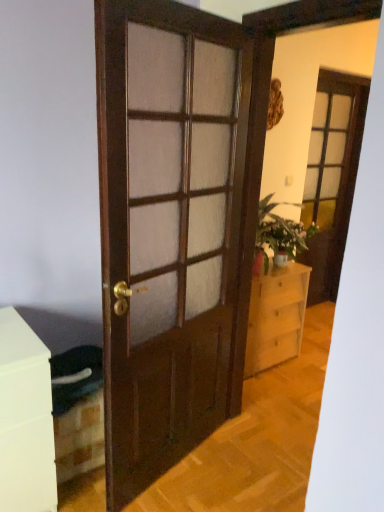
Question: In terms of width, does matte glass screen door at upper right look wider or thinner when compared to matte pink vase at center-right?

Choices:
 (A) wide
 (B) thin

Answer: (B)

Question: In terms of height, does matte glass screen door at upper right look taller or shorter compared to matte pink vase at center-right?

Choices:
 (A) short
 (B) tall

Answer: (B)

Question: Which of these objects is positioned closest to the matte pink vase at center-right?

Choices:
 (A) matte glass screen door at upper right
 (B) light wood chest of drawers at center
 (C) wooden door at center

Answer: (B)

Question: Estimate the real-world distances between objects in this image. Which object is closer to the light wood chest of drawers at center?

Choices:
 (A) matte pink vase at center-right
 (B) wooden door at center
 (C) matte glass screen door at upper right

Answer: (A)